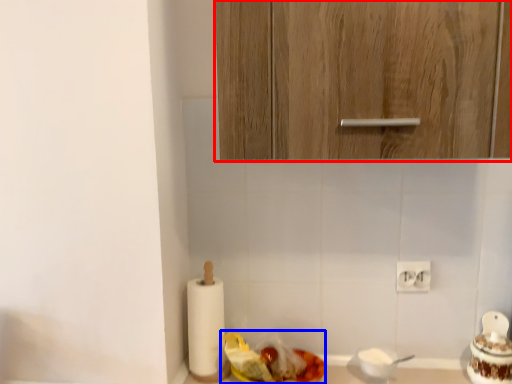
Question: Which of the following is the farthest to the observer, cabinetry (highlighted by a red box) or food (highlighted by a blue box)?

Choices:
 (A) cabinetry
 (B) food

Answer: (B)